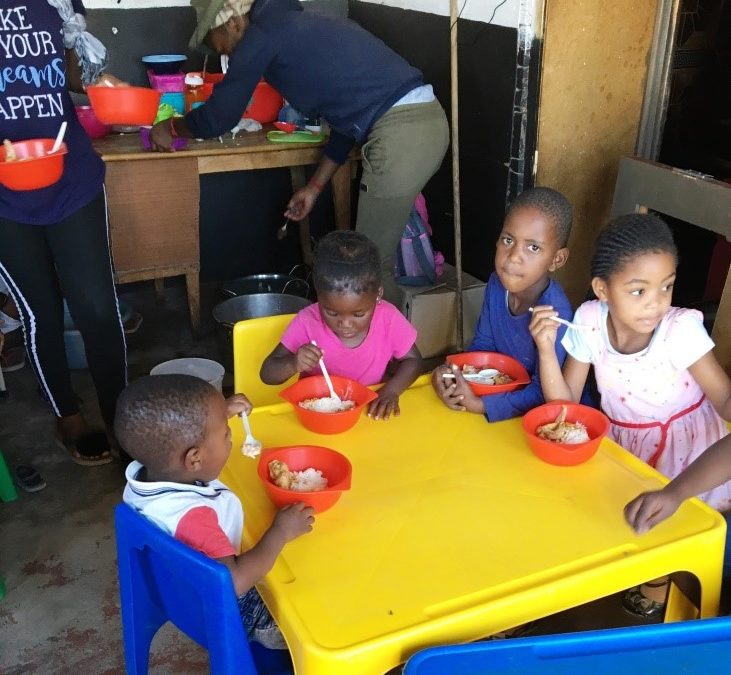
Image resolution: width=731 pixels, height=675 pixels. Find the location of `spoon`. spoon is located at coordinates (335, 378), (330, 400).